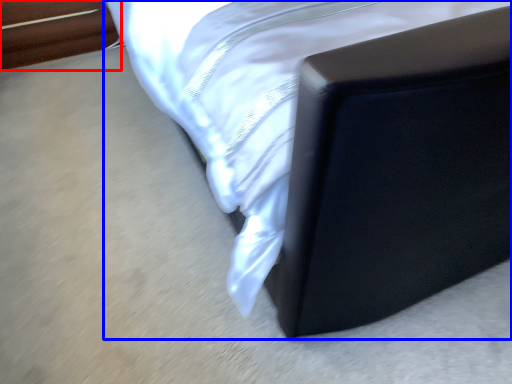
Question: Which point is further to the camera, furniture (highlighted by a red box) or furniture (highlighted by a blue box)?

Choices:
 (A) furniture
 (B) furniture

Answer: (A)